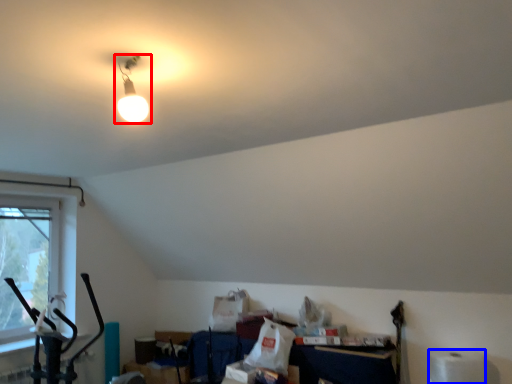
Question: Which of the following is the closest to the observer, lamp (highlighted by a red box) or toilet paper (highlighted by a blue box)?

Choices:
 (A) lamp
 (B) toilet paper

Answer: (A)